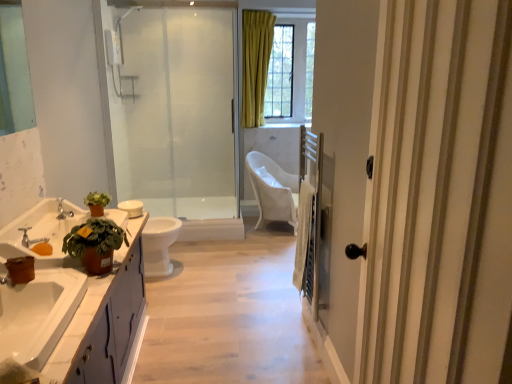
Question: Is white glossy cabinet at lower left to the right of white glossy cabinet at lower left from the viewer's perspective?

Choices:
 (A) yes
 (B) no

Answer: (B)

Question: Does white glossy cabinet at lower left lie in front of white glossy cabinet at lower left?

Choices:
 (A) yes
 (B) no

Answer: (A)

Question: Can you confirm if white glossy cabinet at lower left is thinner than white glossy cabinet at lower left?

Choices:
 (A) yes
 (B) no

Answer: (B)

Question: Is white glossy cabinet at lower left far from white glossy cabinet at lower left?

Choices:
 (A) no
 (B) yes

Answer: (A)

Question: From the image's perspective, is white glossy cabinet at lower left beneath white glossy cabinet at lower left?

Choices:
 (A) no
 (B) yes

Answer: (A)

Question: From a real-world perspective, does white glossy cabinet at lower left stand above white glossy cabinet at lower left?

Choices:
 (A) yes
 (B) no

Answer: (A)

Question: Is white glossy sink at lower left, the second sink positioned from the back, oriented towards white glossy cabinet at lower left?

Choices:
 (A) no
 (B) yes

Answer: (B)

Question: Is white glossy sink at lower left, the second sink positioned from the back, bigger than white glossy cabinet at lower left?

Choices:
 (A) no
 (B) yes

Answer: (A)

Question: Is white glossy sink at lower left, the second sink positioned from the back, thinner than white glossy cabinet at lower left?

Choices:
 (A) no
 (B) yes

Answer: (B)

Question: Does white glossy sink at lower left, which is the first sink in front-to-back order, lie in front of white glossy cabinet at lower left?

Choices:
 (A) no
 (B) yes

Answer: (B)

Question: Is white glossy sink at lower left, the second sink positioned from the back, shorter than white glossy cabinet at lower left?

Choices:
 (A) no
 (B) yes

Answer: (B)

Question: Is white glossy sink at lower left, which is the first sink in front-to-back order, not close to white glossy cabinet at lower left?

Choices:
 (A) no
 (B) yes

Answer: (A)

Question: Does woven white chair at center appear on the right side of white glossy toilet bowl at center?

Choices:
 (A) yes
 (B) no

Answer: (A)